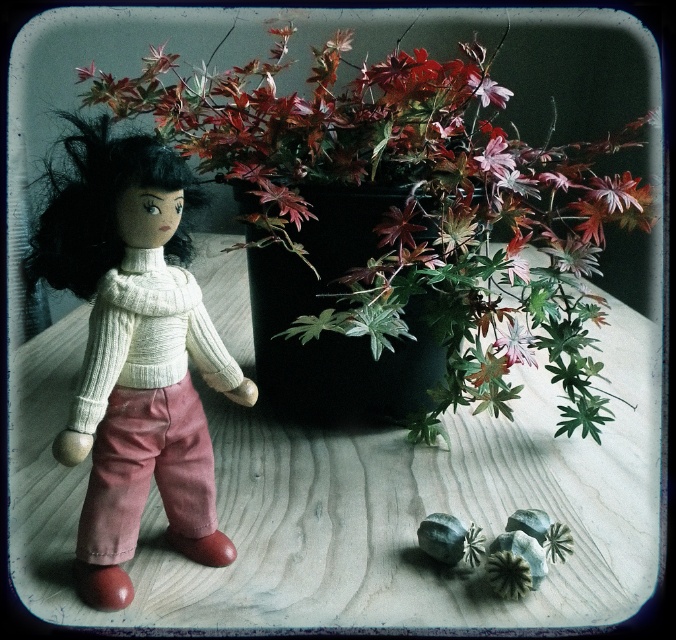
Based on the photo, you are standing at the origin point in the image. The point (x=135, y=352) is located where relative to the origin?

The point (x=135, y=352) is located at the center of the image.

You are a photographer adjusting your camera to focus on two points in the scene. The first point is point (485, 461) and the second is point (220, 83). Which point should you focus on first to ensure the closest object is sharp?

Point (485, 461) is closer to the camera than point (220, 83), so you should focus on point (485, 461) first to ensure the closest object is sharp.